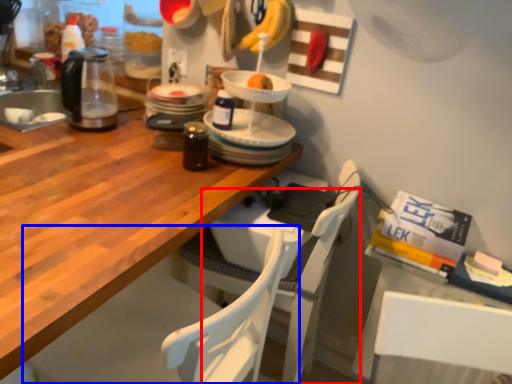
Question: Which object is closer to the camera taking this photo, chair (highlighted by a red box) or chair (highlighted by a blue box)?

Choices:
 (A) chair
 (B) chair

Answer: (B)